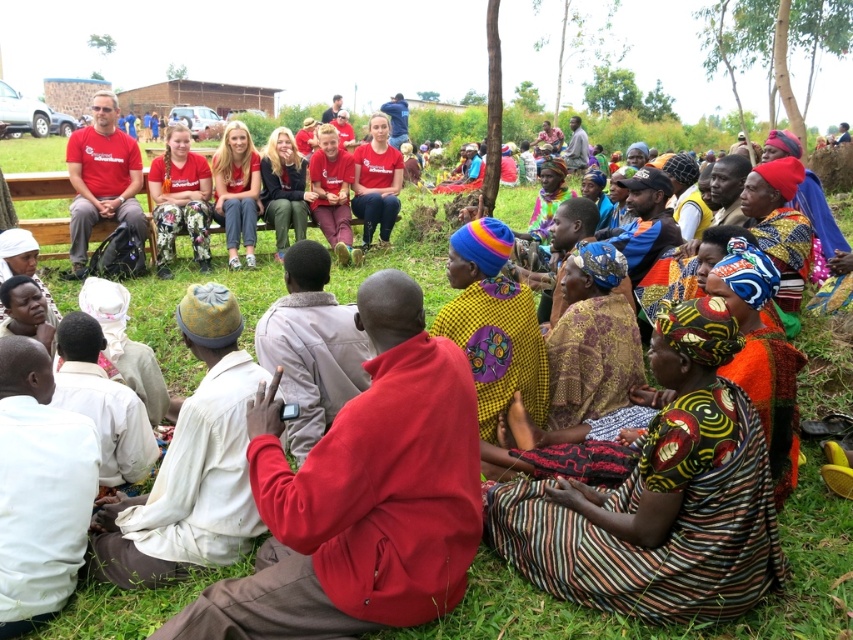
Based on the scene description, which object is positioned lower in the image, the striped fabric dress at lower right or the multicolored woven cloth at center?

The striped fabric dress at lower right is positioned below the multicolored woven cloth at center, so it is lower in the image.

You are organizing a photo shoot and need to ensure that the striped fabric dress at lower right and the multicolored woven cloth at center are both visible in the frame. Based on their sizes, which object should be placed closer to the camera to maintain visibility?

The striped fabric dress at lower right should be placed closer to the camera since it has a greater height compared to the multicolored woven cloth at center, ensuring both remain visible in the frame.

Please look at the image. There is a point marked at coordinates [660,497]. Which object from the list below is located at that point? The options are striped fabric dress at lower right, brick building in the background, or vehicles parked nearby.

The point at coordinates [660,497] indicates the striped fabric dress at lower right.